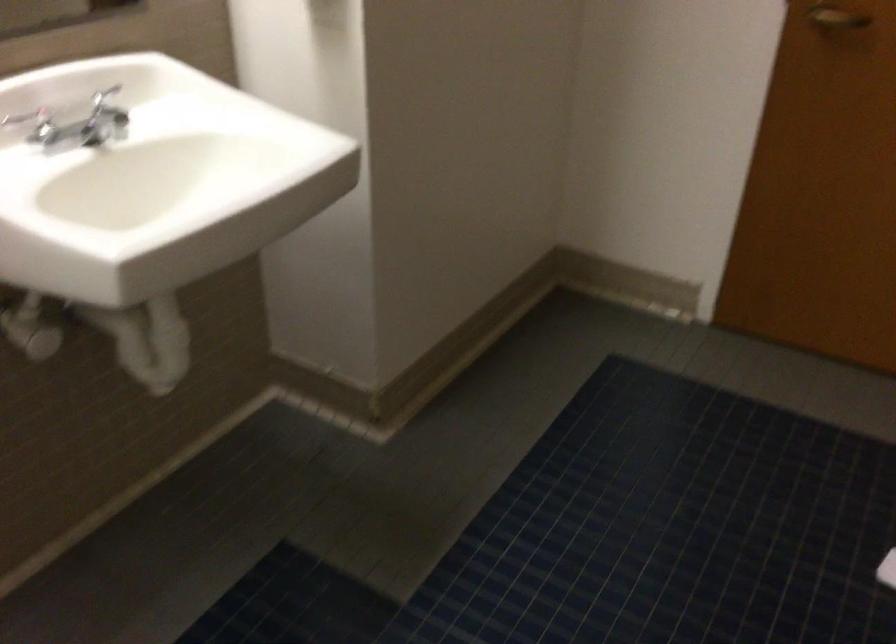
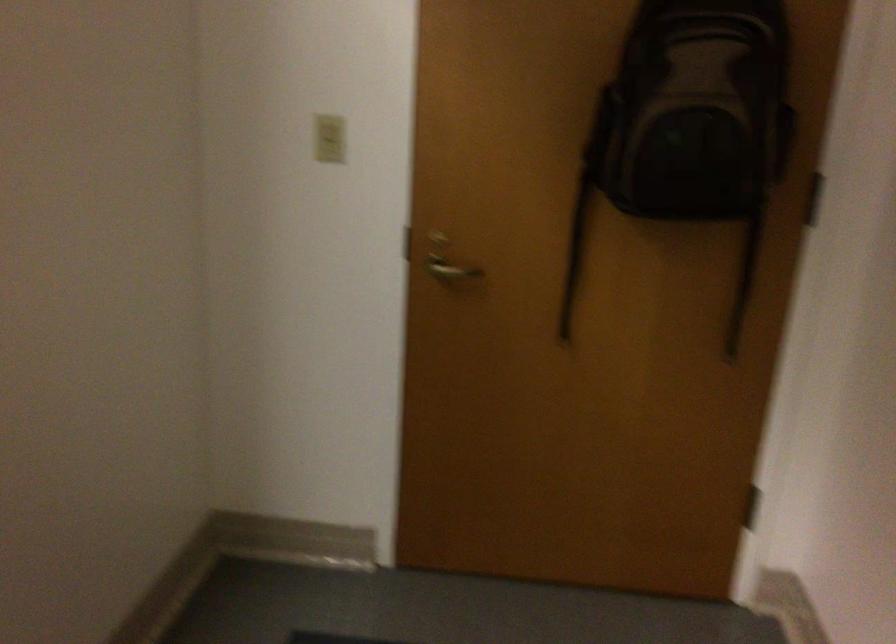
Question: In a continuous first-person perspective shot, in which direction is the camera moving?

Choices:
 (A) Left
 (B) Right
 (C) Forward
 (D) Backward

Answer: (C)